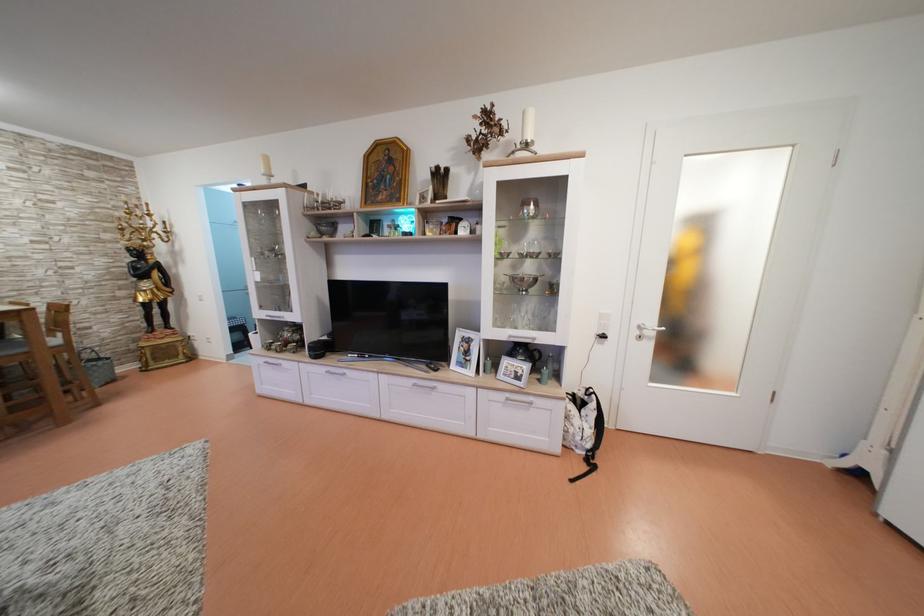
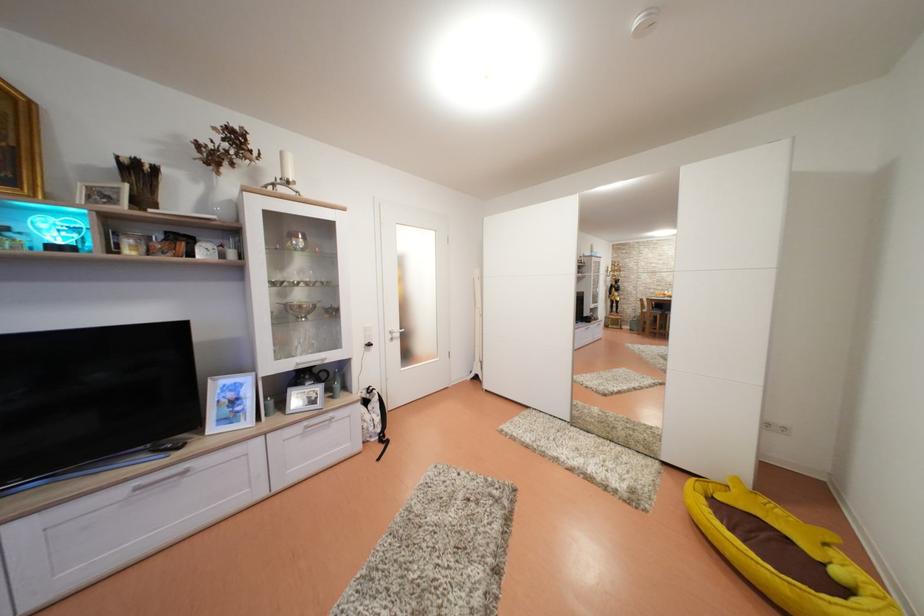
Question: How did the camera likely rotate?

Choices:
 (A) Left
 (B) Right
 (C) Up
 (D) Down

Answer: (B)